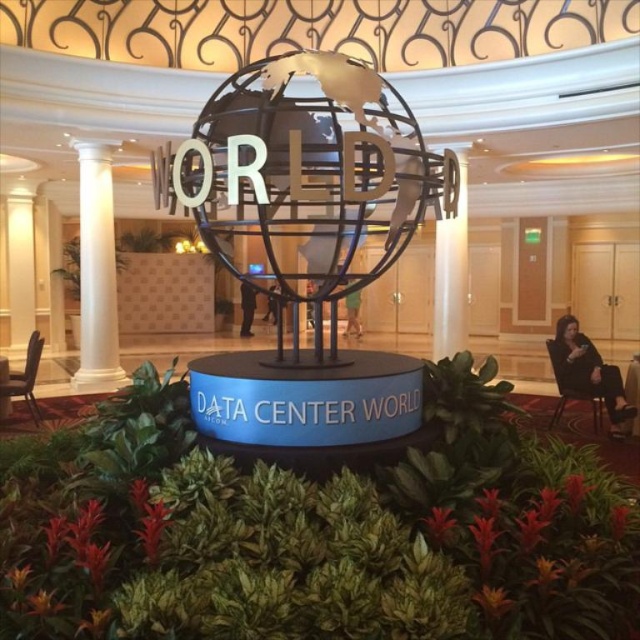
Question: Which is nearer to the black fabric chair at right?

Choices:
 (A) white glossy pillar at center
 (B) metallic globe at center
 (C) white marble column at left

Answer: (A)

Question: Can you confirm if metallic globe at center is positioned to the right of white marble column at left?

Choices:
 (A) yes
 (B) no

Answer: (A)

Question: Is metallic globe at center to the left of white glossy pillar at center from the viewer's perspective?

Choices:
 (A) no
 (B) yes

Answer: (B)

Question: Which of the following is the farthest from the observer?

Choices:
 (A) (611, 408)
 (B) (352, 362)

Answer: (A)

Question: Which object is farther from the camera taking this photo?

Choices:
 (A) white glossy pillar at center
 (B) metallic globe at center
 (C) black fabric chair at right

Answer: (A)

Question: In this image, where is metallic globe at center located relative to black fabric chair at right?

Choices:
 (A) right
 (B) left

Answer: (B)